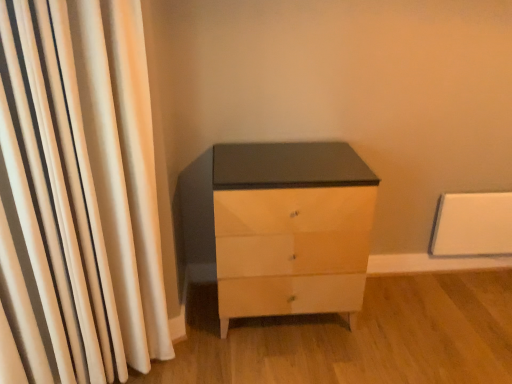
Identify the location of white fabric curtain at left. (77, 195).

What do you see at coordinates (77, 195) in the screenshot? I see `white fabric curtain at left` at bounding box center [77, 195].

The height and width of the screenshot is (384, 512). Describe the element at coordinates (281, 227) in the screenshot. I see `matte white chest of drawers at center` at that location.

This screenshot has width=512, height=384. I want to click on matte white chest of drawers at center, so click(281, 227).

The width and height of the screenshot is (512, 384). In order to click on white fabric curtain at left in this screenshot , I will do `click(77, 195)`.

Is white fabric curtain at left to the left or to the right of matte white chest of drawers at center in the image?

white fabric curtain at left is positioned on matte white chest of drawers at center's left side.

Is the depth of white fabric curtain at left greater than that of matte white chest of drawers at center?

No, white fabric curtain at left is in front of matte white chest of drawers at center.

Does point (22, 301) appear closer or farther from the camera than point (187, 195)?

Clearly, point (22, 301) is closer to the camera than point (187, 195).

From the image's perspective, between white fabric curtain at left and matte white chest of drawers at center, which one is located above?

Answer: white fabric curtain at left is shown above in the image.

From a real-world perspective, is white fabric curtain at left under matte white chest of drawers at center?

Incorrect, from a real-world perspective, white fabric curtain at left is higher than matte white chest of drawers at center.

Considering the sizes of white fabric curtain at left and matte white chest of drawers at center in the image, is white fabric curtain at left wider or thinner than matte white chest of drawers at center?

Clearly, white fabric curtain at left has less width compared to matte white chest of drawers at center.

Who is shorter, white fabric curtain at left or matte white chest of drawers at center?

With less height is matte white chest of drawers at center.

Is white fabric curtain at left bigger or smaller than matte white chest of drawers at center?

In the image, white fabric curtain at left appears to be smaller than matte white chest of drawers at center.

Is white fabric curtain at left spatially inside matte white chest of drawers at center, or outside of it?

The correct answer is: outside.

Are white fabric curtain at left and matte white chest of drawers at center beside each other?

No, white fabric curtain at left is not in contact with matte white chest of drawers at center.

Is matte white chest of drawers at center at the back of white fabric curtain at left?

No, matte white chest of drawers at center is not at the back of white fabric curtain at left.

How far apart are white fabric curtain at left and matte white chest of drawers at center?

The distance of white fabric curtain at left from matte white chest of drawers at center is 60.79 centimeters.

In the image, there is a matte white chest of drawers at center. At what (x,y) coordinates should I click in order to perform the action: click on curtain above it (from the image's perspective). Please return your answer as a coordinate pair (x, y). The height and width of the screenshot is (384, 512). Looking at the image, I should click on click(77, 195).

Which is more to the left, matte white chest of drawers at center or white fabric curtain at left?

From the viewer's perspective, white fabric curtain at left appears more on the left side.

Which object is further away from the camera, matte white chest of drawers at center or white fabric curtain at left?

matte white chest of drawers at center.

Between point (273, 302) and point (167, 321), which one is positioned behind?

Point (273, 302)

From the image's perspective, is matte white chest of drawers at center located above white fabric curtain at left?

No, from the image's perspective, matte white chest of drawers at center is not on top of white fabric curtain at left.

From a real-world perspective, is matte white chest of drawers at center over white fabric curtain at left?

No.

Looking at this image, does matte white chest of drawers at center have a lesser width compared to white fabric curtain at left?

No.

Which of these two, matte white chest of drawers at center or white fabric curtain at left, stands shorter?

matte white chest of drawers at center is shorter.

Does matte white chest of drawers at center have a larger size compared to white fabric curtain at left?

Yes.

Is matte white chest of drawers at center situated inside white fabric curtain at left or outside?

matte white chest of drawers at center is located beyond the bounds of white fabric curtain at left.

In the scene shown: Is matte white chest of drawers at center positioned far away from white fabric curtain at left?

That's not correct — matte white chest of drawers at center is a little close to white fabric curtain at left.

Is matte white chest of drawers at center looking in the opposite direction of white fabric curtain at left?

matte white chest of drawers at center is not turned away from white fabric curtain at left.

Can you tell me how much matte white chest of drawers at center and white fabric curtain at left differ in facing direction?

The angle between the facing direction of matte white chest of drawers at center and the facing direction of white fabric curtain at left is 27.6 degrees.

How much distance is there between matte white chest of drawers at center and white fabric curtain at left?

matte white chest of drawers at center and white fabric curtain at left are 23.93 inches apart from each other.

Locate an element on the screen. curtain above the matte white chest of drawers at center (from the image's perspective) is located at coordinates (77, 195).

You are a GUI agent. You are given a task and a screenshot of the screen. Output one action in this format:
    pyautogui.click(x=<x>, y=<y>)
    Task: Click on the curtain in front of the matte white chest of drawers at center
    The image size is (512, 384).
    Given the screenshot: What is the action you would take?
    pyautogui.click(x=77, y=195)

Image resolution: width=512 pixels, height=384 pixels. I want to click on the chest of drawers that is under the white fabric curtain at left (from a real-world perspective), so click(x=281, y=227).